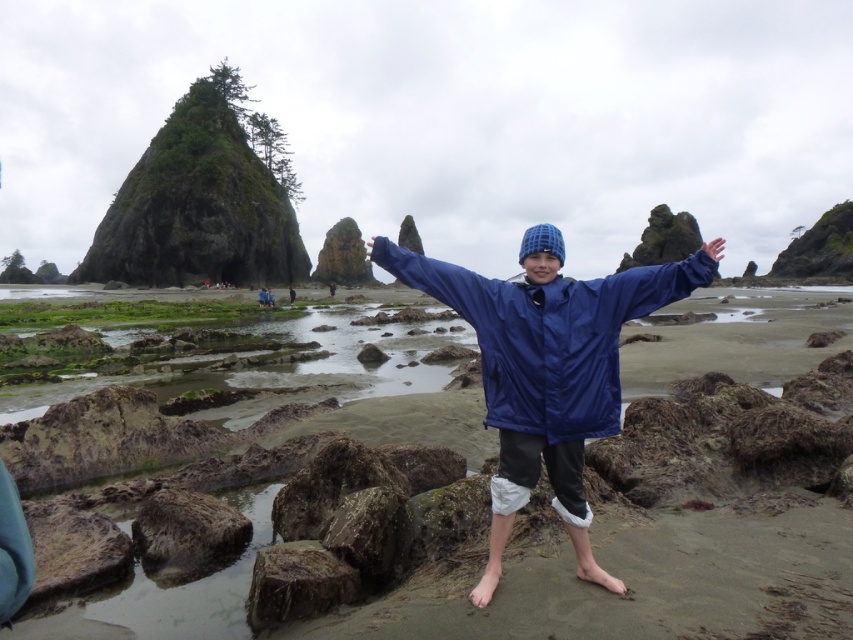
You are a photographer trying to capture the scene of the blue shiny jacket at center and the blue fabric hand at upper center. Which object should you focus on first if you want to include both in your shot without zooming in or out?

The blue shiny jacket at center is bigger than the blue fabric hand at upper center, so you should focus on the blue shiny jacket at center first to ensure it fits properly in the frame before adjusting for the smaller blue fabric hand at upper center.

You are a photographer trying to capture the person in the blue rain jacket at center. You notice a point at coordinates (175,596). Where exactly is this point located on the person?

The point at coordinates (175,596) is located on the blue fabric jacket at center.

You are a photographer trying to capture the scene of the blue fabric jacket at center and the blue fabric hand at upper center. Which object is closer to your camera lens?

The blue fabric jacket at center is closer to the camera lens because it is further to the viewer than the blue fabric hand at upper center.